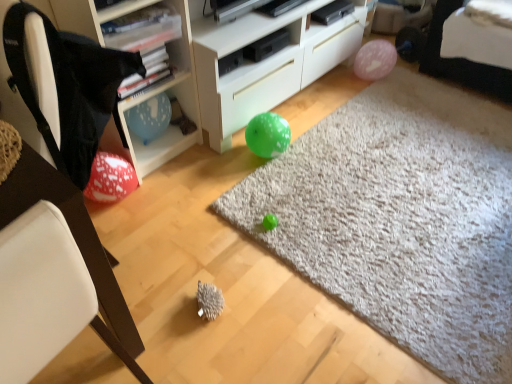
Where is `vacant area that is situated to the right of pink matte balloon at upper right`? This screenshot has width=512, height=384. vacant area that is situated to the right of pink matte balloon at upper right is located at coordinates (404, 78).